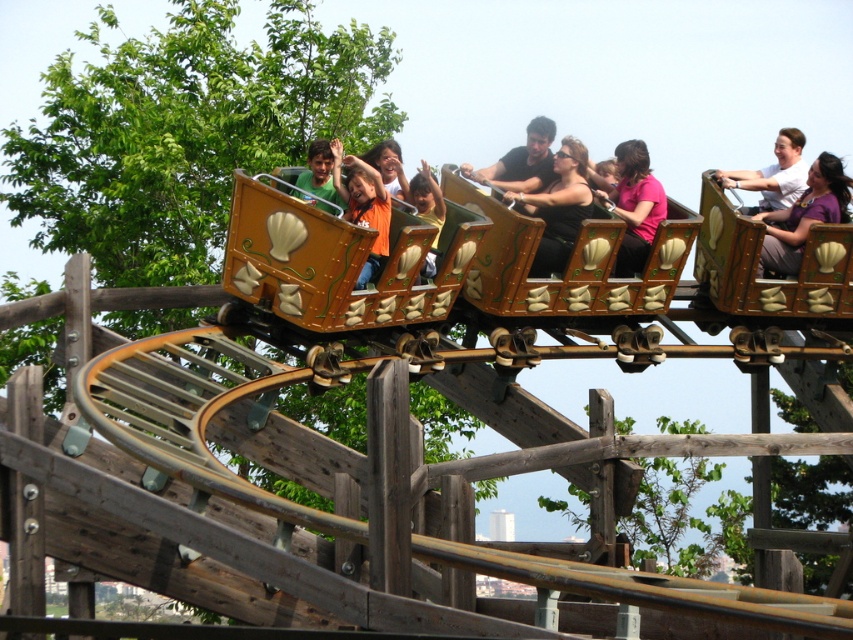
Is pink fabric shirt at center to the left of matte green shirt at center from the viewer's perspective?

Incorrect, pink fabric shirt at center is not on the left side of matte green shirt at center.

Can you confirm if pink fabric shirt at center is taller than matte green shirt at center?

Correct, pink fabric shirt at center is much taller as matte green shirt at center.

Is point (624, 196) positioned after point (322, 164)?

Yes.

Where is `pink fabric shirt at center`? This screenshot has width=853, height=640. pink fabric shirt at center is located at coordinates (635, 205).

Which is more to the right, purple matte shirt at upper right or orange fabric shirt at center?

Positioned to the right is purple matte shirt at upper right.

Which is in front, point (837, 216) or point (355, 196)?

Point (355, 196)

What are the coordinates of `purple matte shirt at upper right` in the screenshot? It's located at (804, 216).

Who is shorter, pink fabric shirt at center or matte orange shirt at center?

Standing shorter between the two is matte orange shirt at center.

Is pink fabric shirt at center to the right of matte orange shirt at center from the viewer's perspective?

Correct, you'll find pink fabric shirt at center to the right of matte orange shirt at center.

Which is behind, point (654, 179) or point (415, 173)?

Point (415, 173)

You are a GUI agent. You are given a task and a screenshot of the screen. Output one action in this format:
    pyautogui.click(x=<x>, y=<y>)
    Task: Click on the pink fabric shirt at center
    Image resolution: width=853 pixels, height=640 pixels.
    Given the screenshot: What is the action you would take?
    pyautogui.click(x=635, y=205)